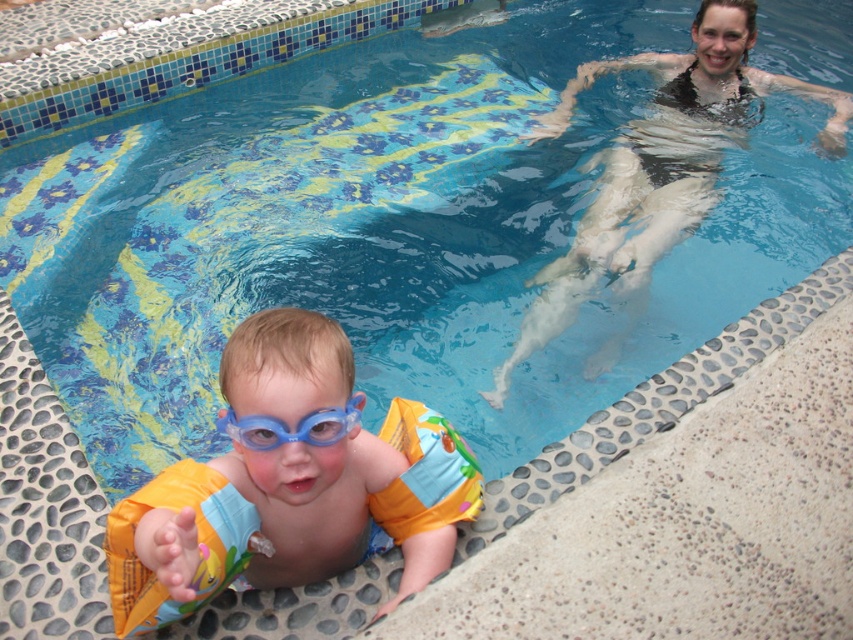
Identify the location of matte black swimsuit at upper right. The height and width of the screenshot is (640, 853). (659, 164).

Does matte black swimsuit at upper right appear over blue rubber goggles at lower center?

Indeed, matte black swimsuit at upper right is positioned over blue rubber goggles at lower center.

Is point (819, 140) less distant than point (335, 417)?

No, (819, 140) is further to viewer.

You are a GUI agent. You are given a task and a screenshot of the screen. Output one action in this format:
    pyautogui.click(x=<x>, y=<y>)
    Task: Click on the matte black swimsuit at upper right
    Image resolution: width=853 pixels, height=640 pixels.
    Given the screenshot: What is the action you would take?
    pyautogui.click(x=659, y=164)

Who is more forward, (x=379, y=467) or (x=299, y=433)?

Positioned in front is point (x=299, y=433).

Between blue rubber arm bands at lower left and blue rubber goggles at lower center, which one appears on the left side from the viewer's perspective?

blue rubber arm bands at lower left

Find the location of a particular element. blue rubber arm bands at lower left is located at coordinates (289, 483).

Is blue rubber arm bands at lower left to the left of matte black swimsuit at upper right from the viewer's perspective?

Correct, you'll find blue rubber arm bands at lower left to the left of matte black swimsuit at upper right.

Between blue rubber arm bands at lower left and matte black swimsuit at upper right, which one is positioned lower?

blue rubber arm bands at lower left is lower down.

Measure the distance between blue rubber arm bands at lower left and camera.

The distance of blue rubber arm bands at lower left from camera is 37.11 inches.

Find the location of a particular element. Image resolution: width=853 pixels, height=640 pixels. blue rubber arm bands at lower left is located at coordinates (289, 483).